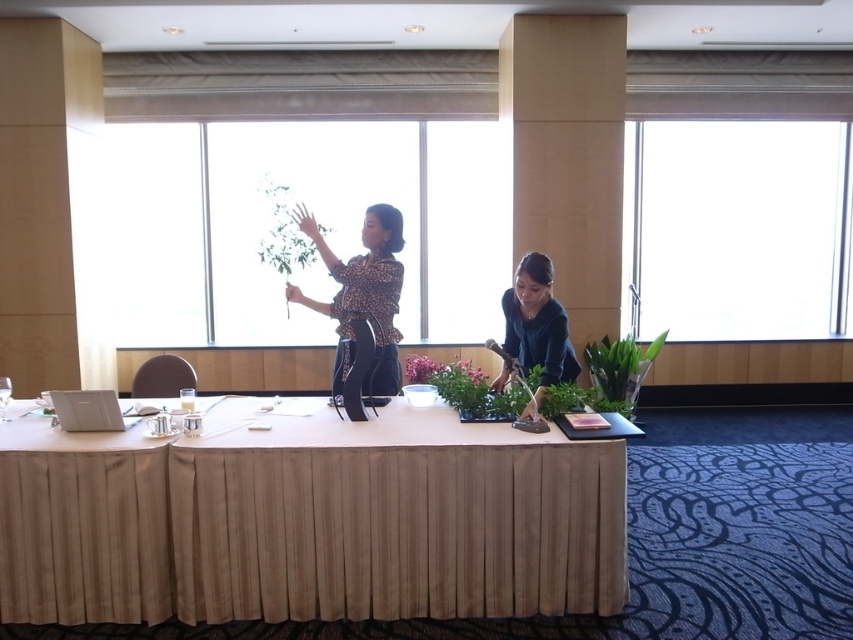
Question: Which point is farther from the camera taking this photo?

Choices:
 (A) (90, 577)
 (B) (374, 356)
 (C) (273, 218)
 (D) (120, 419)

Answer: (C)

Question: Among these objects, which one is farthest from the camera?

Choices:
 (A) beige fabric table at center
 (B) white matte laptop at lower left

Answer: (B)

Question: Among these points, which one is nearest to the camera?

Choices:
 (A) (270, 180)
 (B) (628, 394)
 (C) (543, 349)

Answer: (C)

Question: Does beige fabric table at center appear over leopard print blouse at center?

Choices:
 (A) yes
 (B) no

Answer: (B)

Question: Can you confirm if leopard print blouse at center is positioned above green leafy plant at upper center?

Choices:
 (A) no
 (B) yes

Answer: (A)

Question: Does leopard print blouse at center have a larger size compared to green leafy plant at upper center?

Choices:
 (A) yes
 (B) no

Answer: (B)